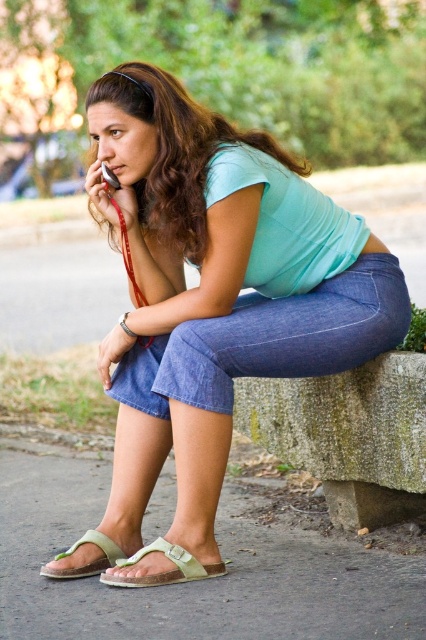
Question: Among these points, which one is farthest from the camera?

Choices:
 (A) (106, 548)
 (B) (273, 321)
 (C) (203, 570)

Answer: (A)

Question: Which of the following is the farthest from the observer?

Choices:
 (A) (118, 554)
 (B) (222, 173)
 (C) (181, 564)

Answer: (A)

Question: Is denim pants at lower center smaller than denim at left?

Choices:
 (A) no
 (B) yes

Answer: (A)

Question: Does denim at left come in front of green suede sandal at lower left?

Choices:
 (A) no
 (B) yes

Answer: (B)

Question: Which is farther from the green suede sandal at lower left?

Choices:
 (A) green cork sandal at lower center
 (B) denim at left
 (C) denim pants at lower center

Answer: (B)

Question: Can you confirm if denim pants at lower center is positioned to the right of denim at left?

Choices:
 (A) yes
 (B) no

Answer: (B)